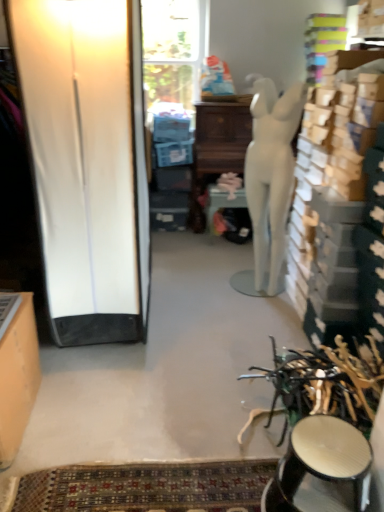
Question: Should I look upward or downward to see white glossy screen door at left?

Choices:
 (A) down
 (B) up

Answer: (B)

Question: Should I look upward or downward to see patterned carpet at lower center?

Choices:
 (A) down
 (B) up

Answer: (A)

Question: From a real-world perspective, is patterned carpet at lower center positioned over matte orange cabinet at left based on gravity?

Choices:
 (A) yes
 (B) no

Answer: (B)

Question: Is patterned carpet at lower center thinner than matte orange cabinet at left?

Choices:
 (A) no
 (B) yes

Answer: (B)

Question: Is patterned carpet at lower center bigger than matte orange cabinet at left?

Choices:
 (A) yes
 (B) no

Answer: (B)

Question: Is the position of patterned carpet at lower center less distant than that of matte orange cabinet at left?

Choices:
 (A) no
 (B) yes

Answer: (A)

Question: Is patterned carpet at lower center aimed at matte orange cabinet at left?

Choices:
 (A) yes
 (B) no

Answer: (B)

Question: Is patterned carpet at lower center positioned beyond the bounds of matte orange cabinet at left?

Choices:
 (A) yes
 (B) no

Answer: (A)

Question: Is matte orange cabinet at left inside shiny metallic stool at lower right?

Choices:
 (A) yes
 (B) no

Answer: (B)

Question: From a real-world perspective, is shiny metallic stool at lower right positioned under matte orange cabinet at left based on gravity?

Choices:
 (A) no
 (B) yes

Answer: (B)

Question: From a real-world perspective, is shiny metallic stool at lower right physically above matte orange cabinet at left?

Choices:
 (A) no
 (B) yes

Answer: (A)

Question: Does shiny metallic stool at lower right have a greater width compared to matte orange cabinet at left?

Choices:
 (A) no
 (B) yes

Answer: (B)

Question: Would you consider shiny metallic stool at lower right to be distant from matte orange cabinet at left?

Choices:
 (A) yes
 (B) no

Answer: (A)

Question: Does shiny metallic stool at lower right have a smaller size compared to matte orange cabinet at left?

Choices:
 (A) no
 (B) yes

Answer: (B)

Question: From the image's perspective, is white matte mannequin at center under patterned carpet at lower center?

Choices:
 (A) yes
 (B) no

Answer: (B)